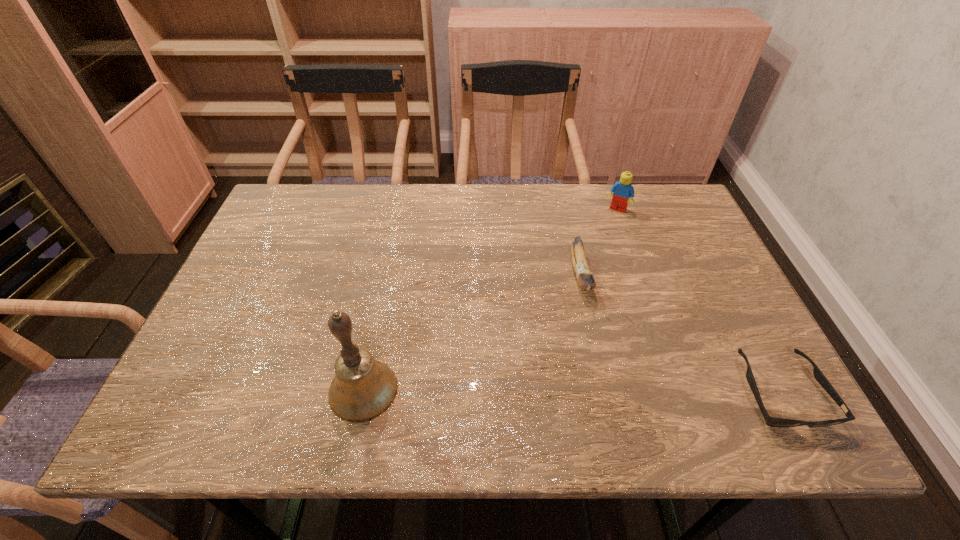
The height and width of the screenshot is (540, 960). In the image, there is a desktop. Find the location of `vacant space at the far edge`. vacant space at the far edge is located at coordinates (546, 229).

This screenshot has height=540, width=960. What are the coordinates of `vacant space at the near edge of the desktop` in the screenshot? It's located at (607, 376).

Locate an element on the screen. The image size is (960, 540). free region at the left edge of the desktop is located at coordinates (263, 307).

Find the location of `vacant space at the right edge of the desktop`. vacant space at the right edge of the desktop is located at coordinates (698, 244).

Identify the location of vacant point at the far left corner. The width and height of the screenshot is (960, 540). (313, 192).

In the image, there is a desktop. At what (x,y) coordinates should I click in order to perform the action: click on free region at the far right corner. Please return your answer as a coordinate pair (x, y). Looking at the image, I should click on (647, 226).

Find the location of a particular element. free space at the near right corner of the desktop is located at coordinates (711, 377).

Where is `vacant space that is in between the bell and the second tallest object`? vacant space that is in between the bell and the second tallest object is located at coordinates point(490,300).

Where is `vacant space that is in between the second object from left to right and the leftmost object`? The image size is (960, 540). vacant space that is in between the second object from left to right and the leftmost object is located at coordinates pos(472,333).

What are the coordinates of `free space between the banana and the leftmost object` in the screenshot? It's located at (472, 333).